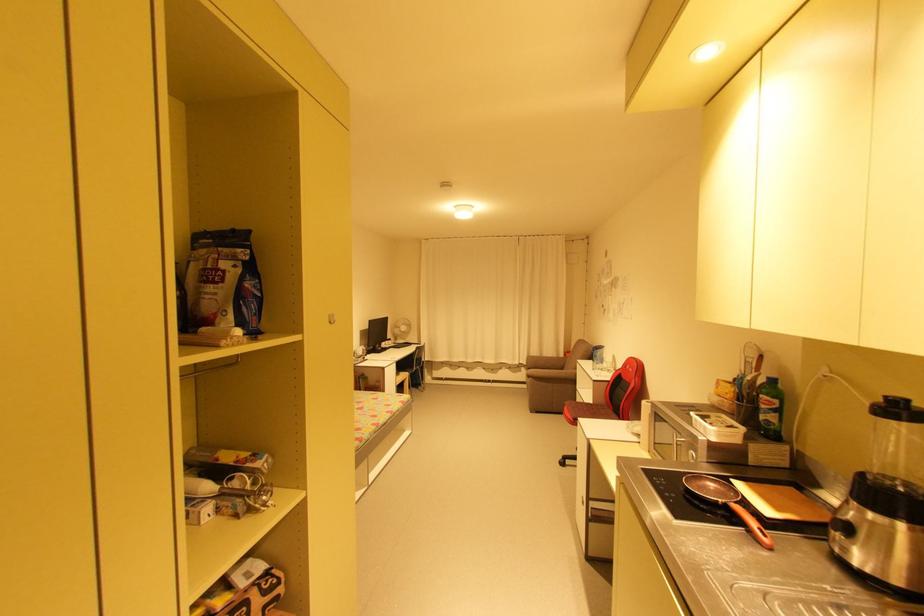
Find where to sit the sofa sitting surface. Please return your answer as a coordinate pair (x, y).

(550, 395)